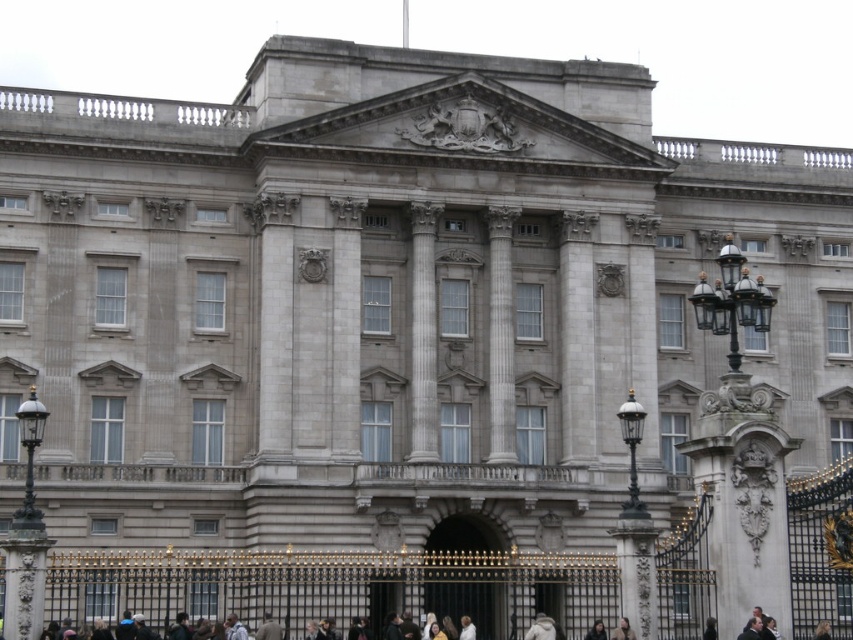
Question: Observing the image, what is the correct spatial positioning of gold ornate gate at center in reference to dark clothing at lower center?

Choices:
 (A) below
 (B) above

Answer: (A)

Question: Which point is closer to the camera?

Choices:
 (A) gold ornate gate at center
 (B) dark clothing at lower center

Answer: (B)

Question: Observing the image, what is the correct spatial positioning of gold ornate gate at center in reference to dark brown hair at center?

Choices:
 (A) below
 (B) above

Answer: (A)

Question: Which object is the farthest from the dark clothing at lower center?

Choices:
 (A) gold ornate gate at center
 (B) dark brown hair at center

Answer: (A)

Question: Can you confirm if gold ornate gate at center is wider than dark clothing at lower center?

Choices:
 (A) no
 (B) yes

Answer: (A)

Question: Among these points, which one is nearest to the camera?

Choices:
 (A) (802, 605)
 (B) (428, 573)
 (C) (596, 632)

Answer: (B)